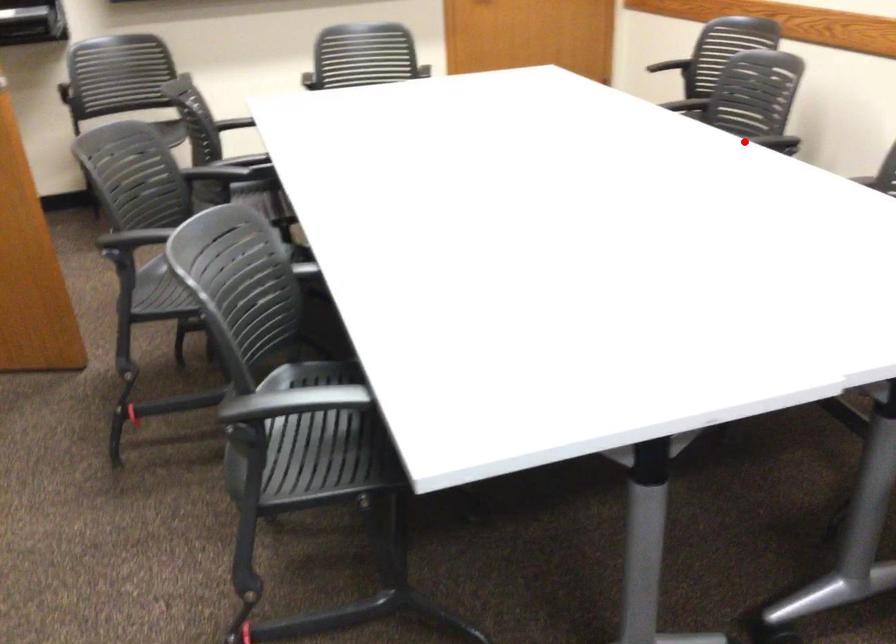
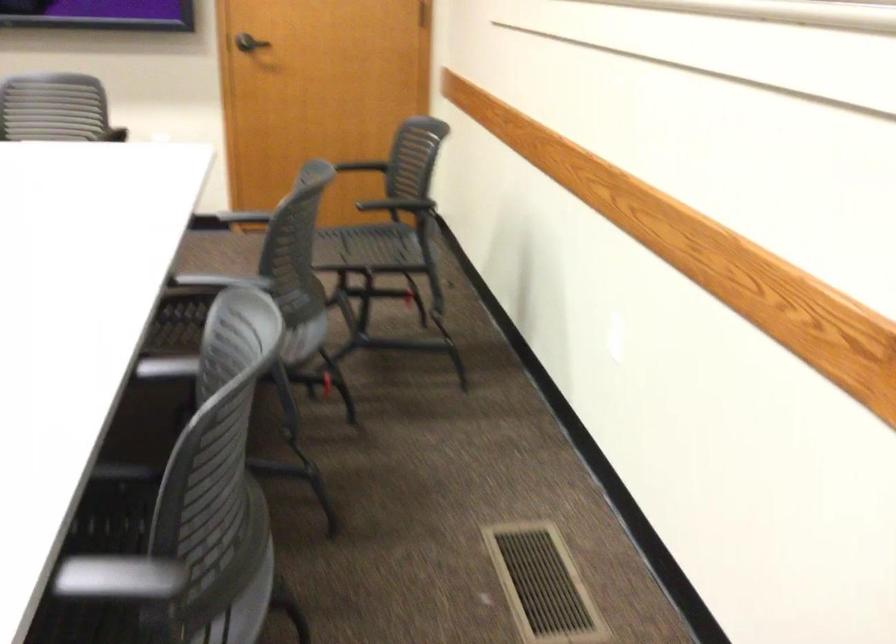
Question: I am providing you with two images of the same scene from different viewpoints. In image1, a red point is highlighted. Considering the same 3D point in image2, which of the following is correct?

Choices:
 (A) It is closer
 (B) It is farther

Answer: (A)